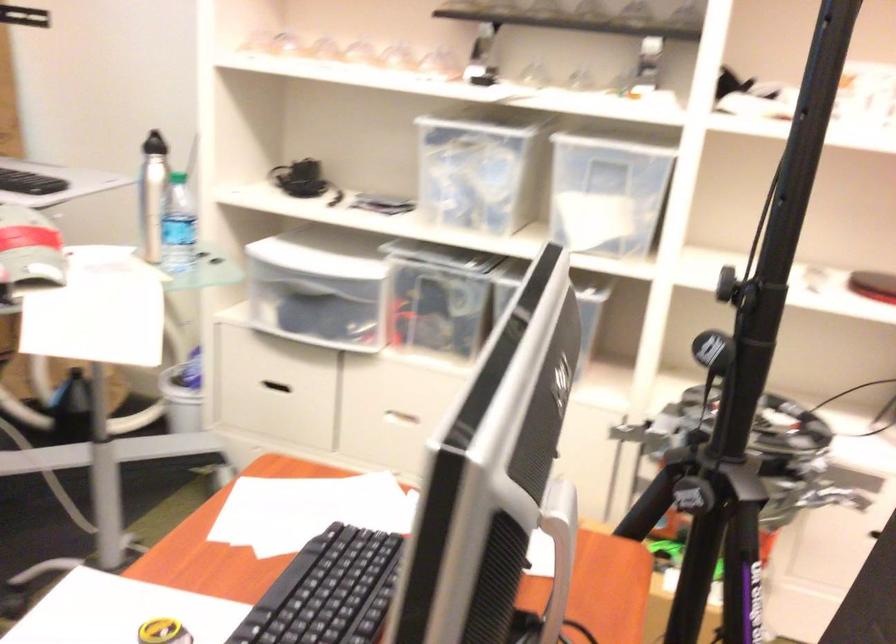
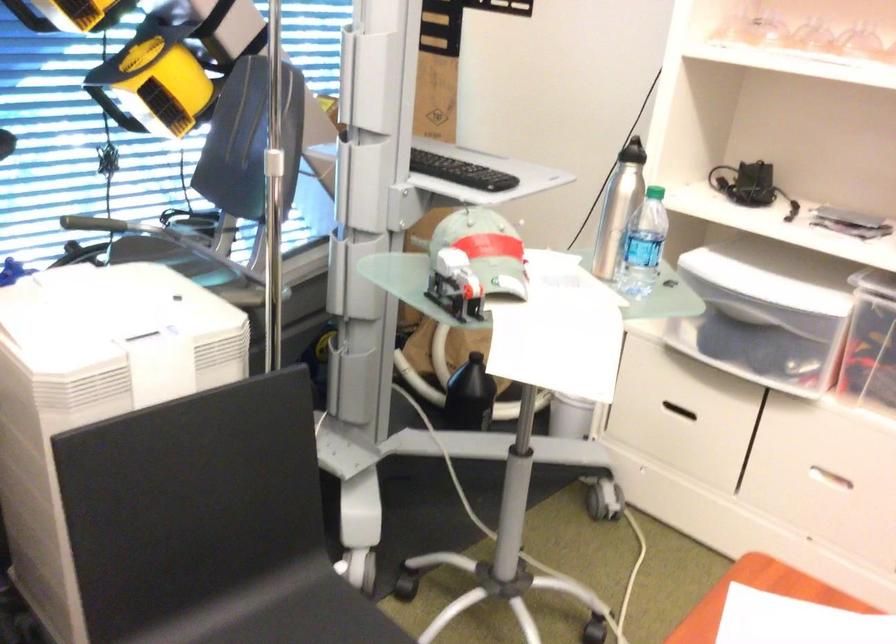
The images are taken continuously from a first-person perspective. In which direction are you moving?

The cameraman moved toward left, forward.